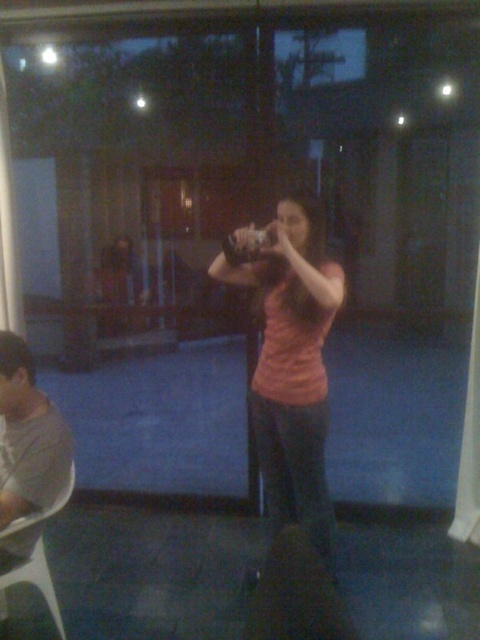
Which of these two, pink matte shirt at center or white plastic chair at lower left, stands taller?

With more height is pink matte shirt at center.

Based on the photo, between pink matte shirt at center and white plastic chair at lower left, which one appears on the right side from the viewer's perspective?

Positioned to the right is pink matte shirt at center.

Is point (300, 397) farther from viewer compared to point (43, 566)?

That is True.

Where is `pink matte shirt at center`? pink matte shirt at center is located at coordinates (292, 364).